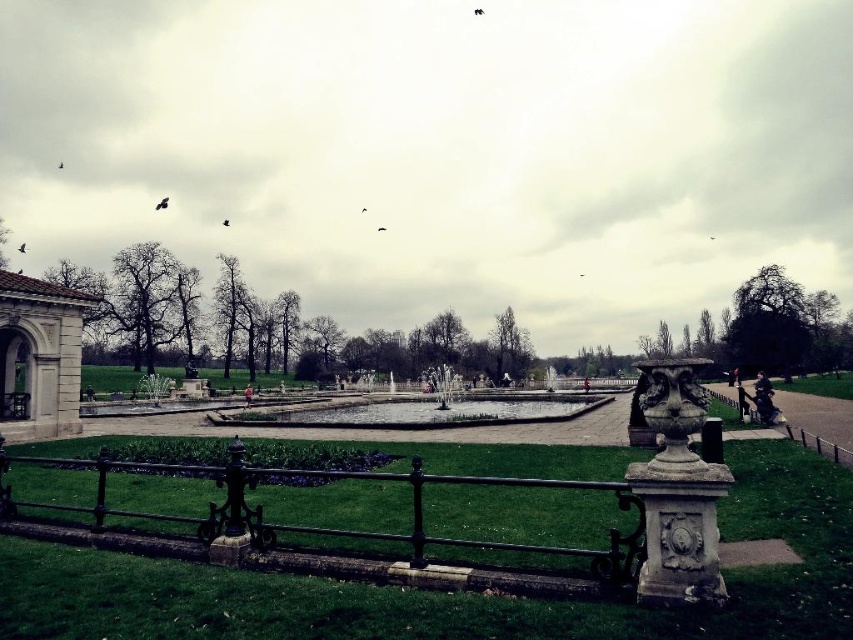
Between black wrought iron fence at lower center and clear glass pond at center, which one is positioned higher?

black wrought iron fence at lower center

Does black wrought iron fence at lower center have a greater width compared to clear glass pond at center?

No, black wrought iron fence at lower center is not wider than clear glass pond at center.

This screenshot has height=640, width=853. Identify the location of black wrought iron fence at lower center. (329, 525).

Between black wrought iron fence at lower center and white stone arch at left, which one has less height?

black wrought iron fence at lower center

Does point (463, 483) lie in front of point (21, 394)?

Yes, point (463, 483) is in front of point (21, 394).

Between point (155, 515) and point (59, 394), which one is positioned behind?

Point (59, 394)

Identify the location of black wrought iron fence at lower center. (329, 525).

Which of these two, white stone arch at left or clear glass pond at center, stands taller?

With more height is white stone arch at left.

Who is positioned more to the left, white stone arch at left or clear glass pond at center?

From the viewer's perspective, white stone arch at left appears more on the left side.

The width and height of the screenshot is (853, 640). Find the location of `white stone arch at left`. white stone arch at left is located at coordinates (39, 356).